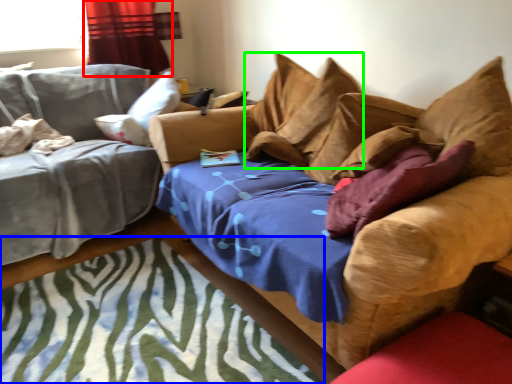
Question: Estimate the real-world distances between objects in this image. Which object is farther from curtain (highlighted by a red box), mat (highlighted by a blue box) or pillow (highlighted by a green box)?

Choices:
 (A) mat
 (B) pillow

Answer: (A)